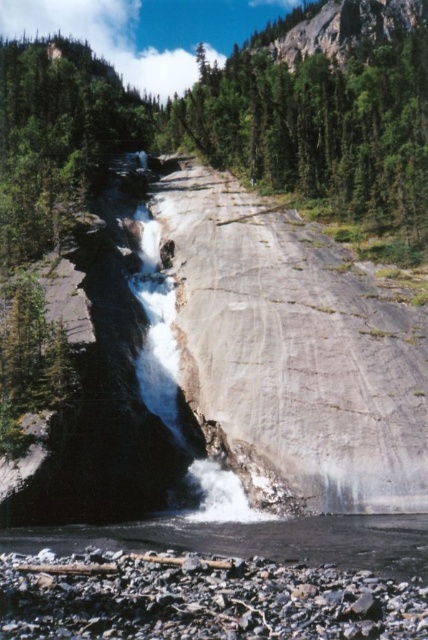
Question: Which object is farther from the camera taking this photo?

Choices:
 (A) green leafy tree at center
 (B) smooth gray rock at lower center

Answer: (A)

Question: Does green leafy tree at center appear over smooth gray rock at lower center?

Choices:
 (A) yes
 (B) no

Answer: (A)

Question: Which object is closer to the camera taking this photo?

Choices:
 (A) green leafy tree at center
 (B) smooth gray rock at lower center

Answer: (B)

Question: Observing the image, what is the correct spatial positioning of green leafy tree at center in reference to smooth gray rock at lower center?

Choices:
 (A) left
 (B) right

Answer: (B)

Question: Is green leafy tree at center further to camera compared to smooth gray rock at lower center?

Choices:
 (A) yes
 (B) no

Answer: (A)

Question: Which object appears farthest from the camera in this image?

Choices:
 (A) green leafy tree at center
 (B) smooth gray rock at lower center

Answer: (A)